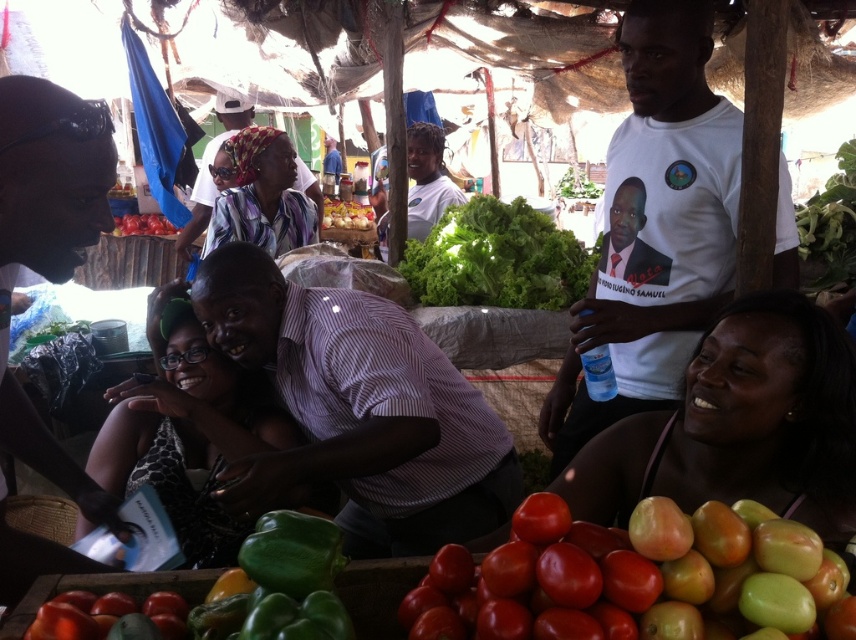
Question: Which point is closer to the camera taking this photo?

Choices:
 (A) (522, 520)
 (B) (800, 397)
 (C) (295, 227)

Answer: (A)

Question: Which object is positioned closest to the ripe red tomato at lower left?

Choices:
 (A) printed fabric headscarf at center
 (B) green leafy lettuce at center
 (C) smooth skin woman at lower right
 (D) green matte pepper at center

Answer: (A)

Question: Is smooth skin woman at lower right below red matte tomatoes at lower center?

Choices:
 (A) no
 (B) yes

Answer: (A)

Question: Is red matte tomatoes at lower center thinner than printed fabric headscarf at center?

Choices:
 (A) no
 (B) yes

Answer: (B)

Question: In this image, where is green matte tomatoes at lower right located relative to matte white shirt at center?

Choices:
 (A) above
 (B) below

Answer: (B)

Question: Which object is positioned closest to the matte white shirt at center?

Choices:
 (A) green leafy lettuce at center
 (B) red matte tomatoes at lower center
 (C) matte black shirt at left
 (D) ripe red tomato at lower left

Answer: (A)